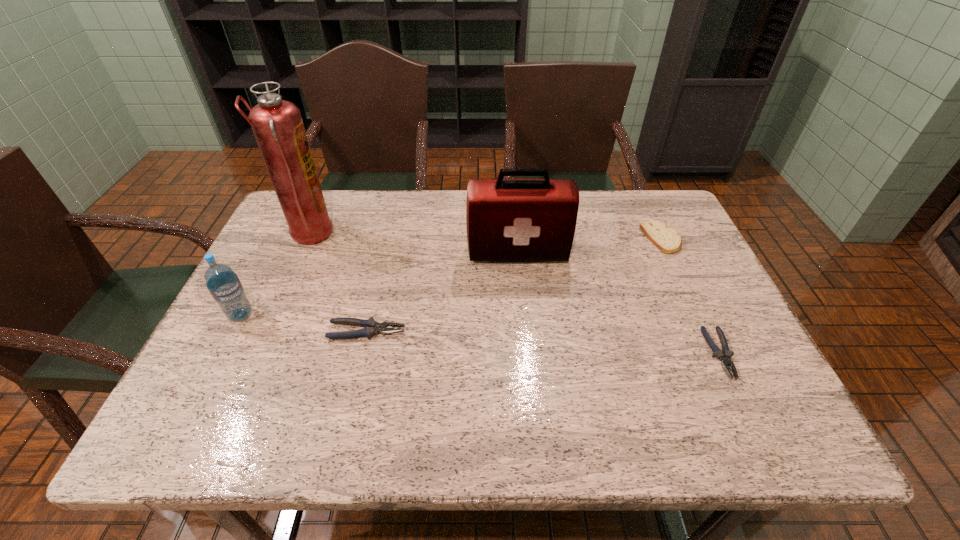
Locate an element on the screen. The width and height of the screenshot is (960, 540). free space that satisfies the following two spatial constraints: 1. on the side of the pita bread with the label; 2. on the left side of the fire extinguisher is located at coordinates (307, 239).

You are a GUI agent. You are given a task and a screenshot of the screen. Output one action in this format:
    pyautogui.click(x=<x>, y=<y>)
    Task: Click on the vacant space that satisfies the following two spatial constraints: 1. on the front side of the pita bread; 2. at the gripping part of the taller pliers
    
    Given the screenshot: What is the action you would take?
    pyautogui.click(x=705, y=331)

What are the coordinates of `free spot that satisfies the following two spatial constraints: 1. on the side of the first aid kit with the cross symbol; 2. at the gripping part of the left pliers` in the screenshot? It's located at (525, 331).

The height and width of the screenshot is (540, 960). In order to click on free space that satisfies the following two spatial constraints: 1. on the back side of the pita bread; 2. on the side of the fire extinguisher with the label in this screenshot , I will do `click(660, 235)`.